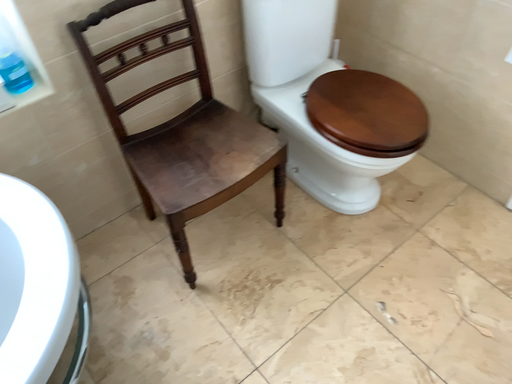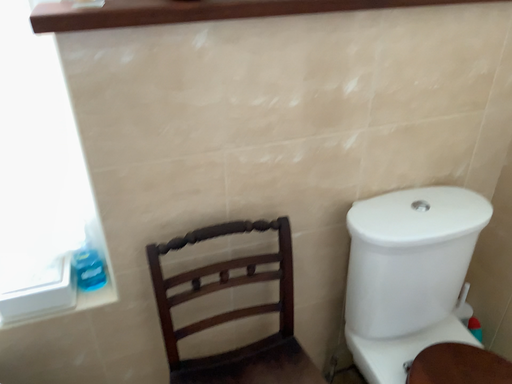
Question: Which way did the camera rotate in the video?

Choices:
 (A) rotated right
 (B) rotated left

Answer: (B)